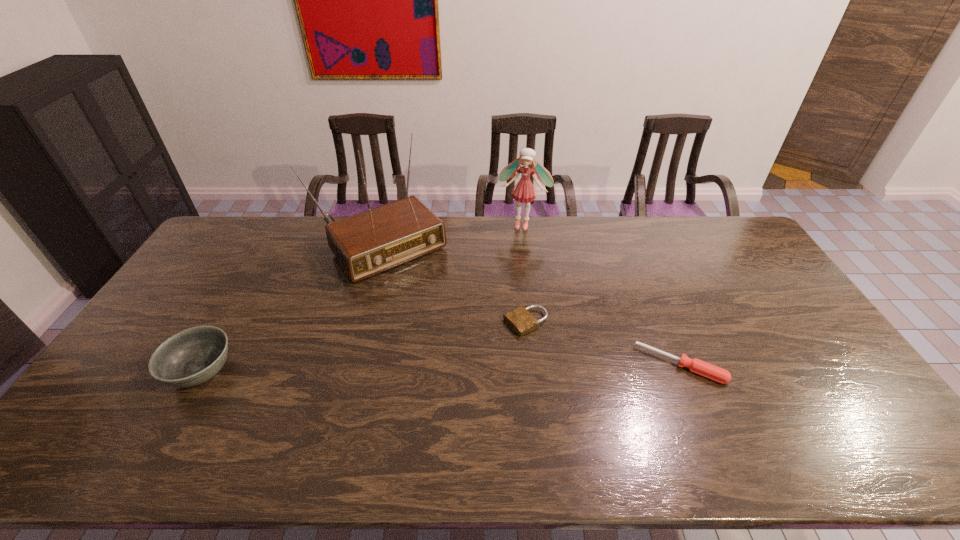
Locate an element on the screen. This screenshot has height=540, width=960. blank area in the image that satisfies the following two spatial constraints: 1. on the front side of the rightmost object; 2. on the left side of the doll is located at coordinates (540, 365).

Image resolution: width=960 pixels, height=540 pixels. In order to click on vacant position in the image that satisfies the following two spatial constraints: 1. on the front side of the second shortest object; 2. on the right side of the padlock in this screenshot , I will do `click(530, 365)`.